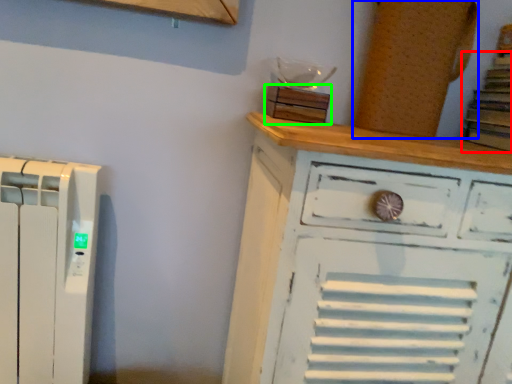
Question: Which is nearer to the book (highlighted by a red box)? wood (highlighted by a blue box) or wood (highlighted by a green box).

Choices:
 (A) wood
 (B) wood

Answer: (A)